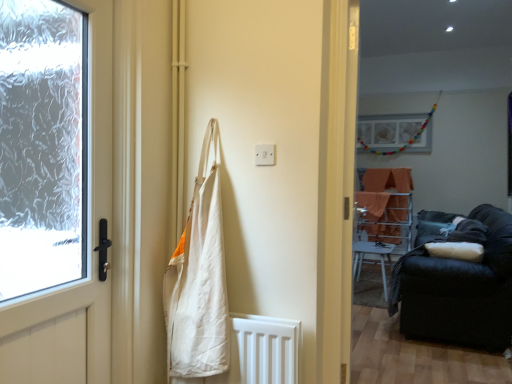
Question: Is orange fabric at center positioned in front of white canvas bag at center?

Choices:
 (A) yes
 (B) no

Answer: (B)

Question: Is orange fabric at center further to the viewer compared to white canvas bag at center?

Choices:
 (A) no
 (B) yes

Answer: (B)

Question: Is orange fabric at center not inside white canvas bag at center?

Choices:
 (A) no
 (B) yes

Answer: (B)

Question: Considering the relative sizes of orange fabric at center and white canvas bag at center in the image provided, is orange fabric at center shorter than white canvas bag at center?

Choices:
 (A) yes
 (B) no

Answer: (A)

Question: Is orange fabric at center beside white canvas bag at center?

Choices:
 (A) yes
 (B) no

Answer: (B)

Question: Is point (193, 241) positioned closer to the camera than point (92, 375)?

Choices:
 (A) closer
 (B) farther

Answer: (B)

Question: From the image's perspective, relative to matte white door at left, is white canvas bag at center above or below?

Choices:
 (A) above
 (B) below

Answer: (B)

Question: Is white canvas bag at center to the left or to the right of matte white door at left in the image?

Choices:
 (A) right
 (B) left

Answer: (A)

Question: Relative to matte white door at left, is white canvas bag at center in front or behind?

Choices:
 (A) behind
 (B) front

Answer: (A)

Question: From a real-world perspective, is matte white door at left physically located above or below velvet dark blue couch at right?

Choices:
 (A) below
 (B) above

Answer: (B)

Question: Would you say matte white door at left is to the left or to the right of velvet dark blue couch at right in the picture?

Choices:
 (A) right
 (B) left

Answer: (B)

Question: Would you say matte white door at left is inside or outside velvet dark blue couch at right?

Choices:
 (A) outside
 (B) inside

Answer: (A)

Question: Does point (105, 41) appear closer or farther from the camera than point (505, 312)?

Choices:
 (A) farther
 (B) closer

Answer: (B)

Question: From the image's perspective, is velvet dark blue couch at right positioned above or below matte white door at left?

Choices:
 (A) below
 (B) above

Answer: (A)

Question: In terms of height, does velvet dark blue couch at right look taller or shorter compared to matte white door at left?

Choices:
 (A) short
 (B) tall

Answer: (A)